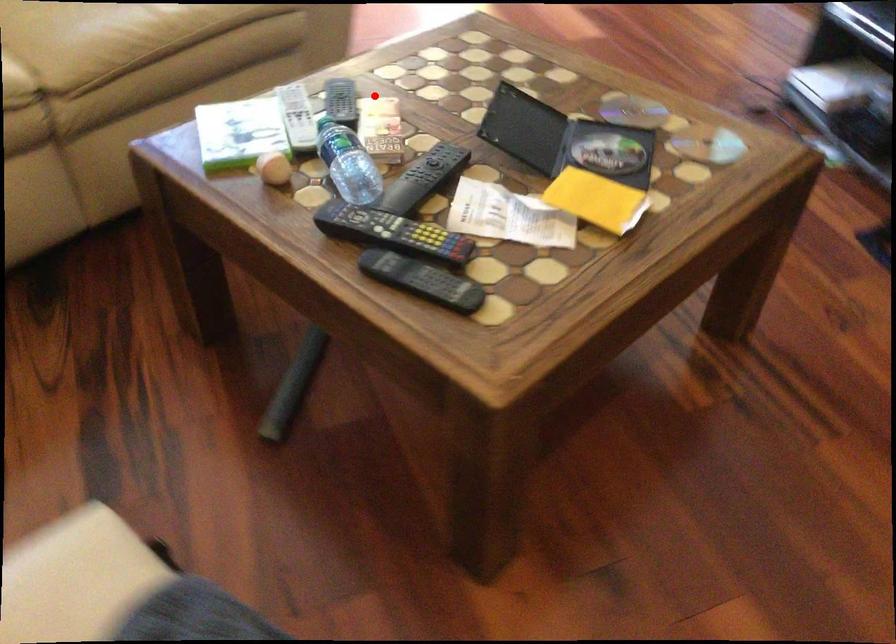
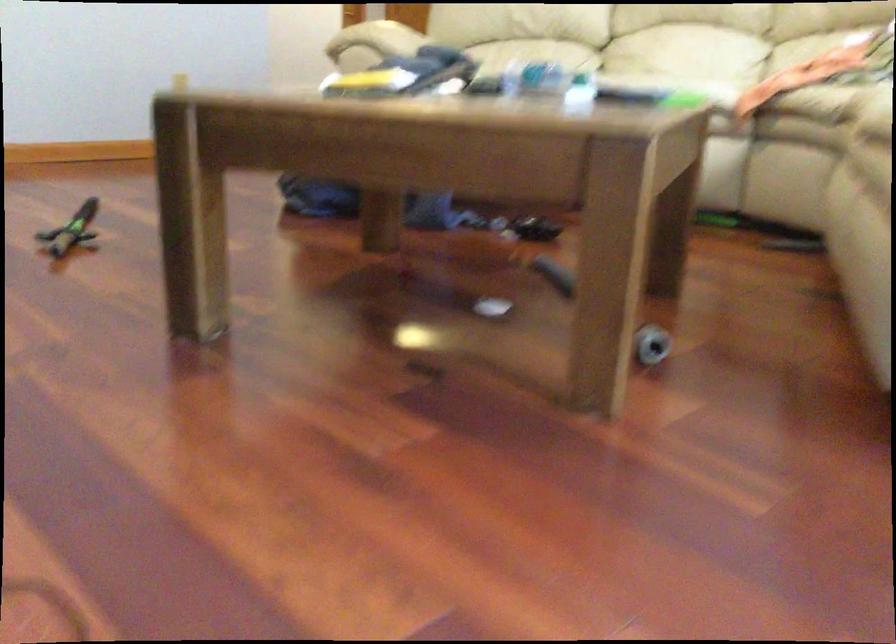
Find the pixel in the second image that matches the highlighted location in the first image.

(580, 93)